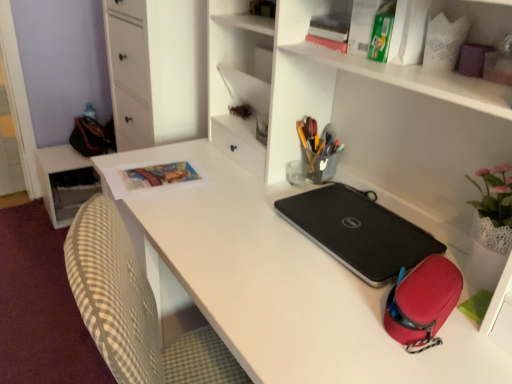
Question: Would you say white glossy table at lower left is outside white matte file cabinet at upper left?

Choices:
 (A) yes
 (B) no

Answer: (A)

Question: Can you confirm if white glossy table at lower left is bigger than white matte file cabinet at upper left?

Choices:
 (A) no
 (B) yes

Answer: (A)

Question: Considering the relative sizes of white glossy table at lower left and white matte file cabinet at upper left in the image provided, is white glossy table at lower left wider than white matte file cabinet at upper left?

Choices:
 (A) no
 (B) yes

Answer: (A)

Question: Is white glossy table at lower left closer to the viewer compared to white matte file cabinet at upper left?

Choices:
 (A) yes
 (B) no

Answer: (B)

Question: Considering the relative sizes of white glossy table at lower left and white matte file cabinet at upper left in the image provided, is white glossy table at lower left thinner than white matte file cabinet at upper left?

Choices:
 (A) yes
 (B) no

Answer: (A)

Question: Is white glossy table at lower left smaller than white matte file cabinet at upper left?

Choices:
 (A) yes
 (B) no

Answer: (A)

Question: From the image's perspective, would you say black textured laptop at center is shown under metallic silver pen holder at center?

Choices:
 (A) yes
 (B) no

Answer: (A)

Question: Is black textured laptop at center facing away from metallic silver pen holder at center?

Choices:
 (A) no
 (B) yes

Answer: (A)

Question: From the image's perspective, is black textured laptop at center on top of metallic silver pen holder at center?

Choices:
 (A) no
 (B) yes

Answer: (A)

Question: Considering the relative positions of black textured laptop at center and metallic silver pen holder at center in the image provided, is black textured laptop at center to the left of metallic silver pen holder at center from the viewer's perspective?

Choices:
 (A) no
 (B) yes

Answer: (A)

Question: Is black textured laptop at center behind metallic silver pen holder at center?

Choices:
 (A) yes
 (B) no

Answer: (B)

Question: Considering the relative sizes of black textured laptop at center and metallic silver pen holder at center in the image provided, is black textured laptop at center wider than metallic silver pen holder at center?

Choices:
 (A) yes
 (B) no

Answer: (A)

Question: Does black textured laptop at center have a greater width compared to white matte desk at center?

Choices:
 (A) no
 (B) yes

Answer: (A)